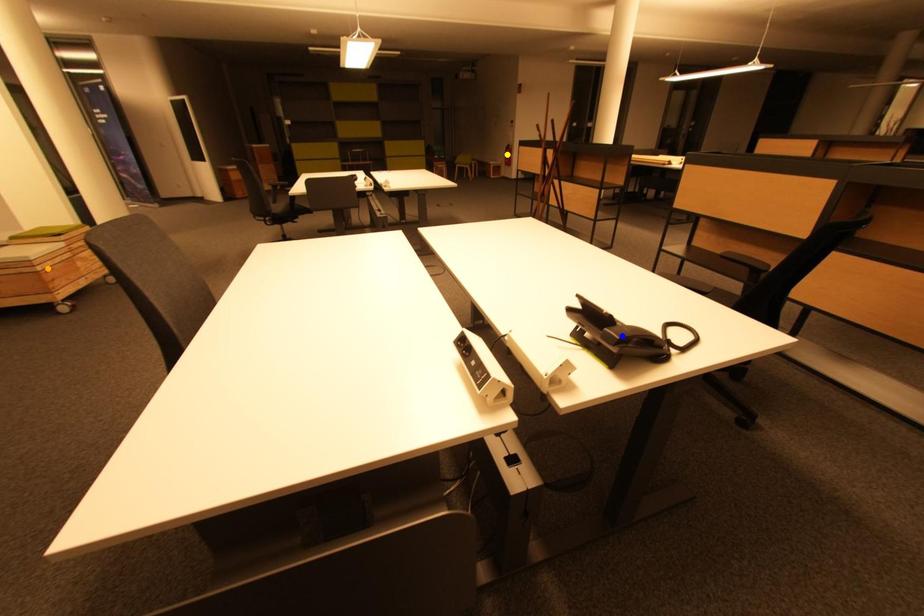
Order these from nearest to farthest:
orange point | blue point | yellow point

1. blue point
2. orange point
3. yellow point